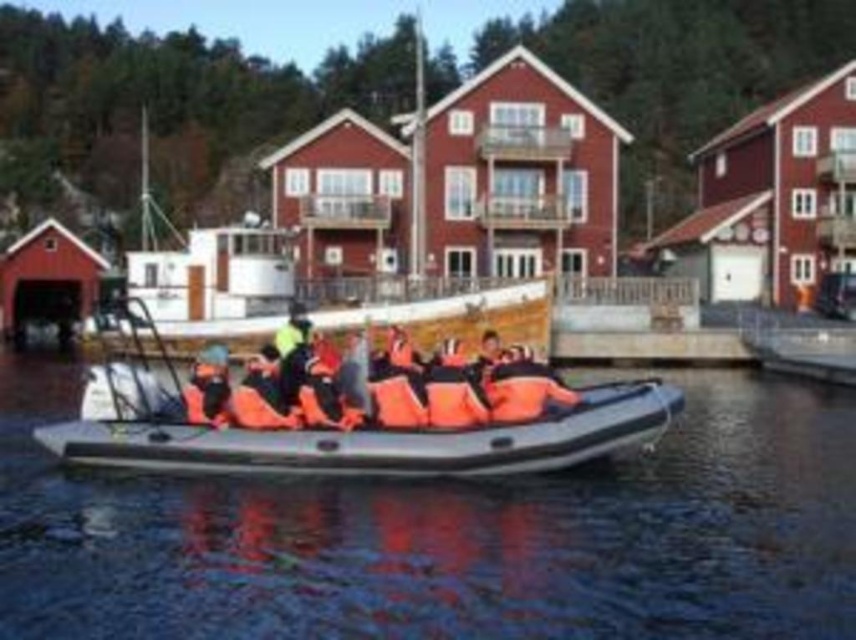
Does black rubber boat at center lie behind orange life vest at center?

That is False.

Who is shorter, black rubber boat at center or orange life vest at center?

orange life vest at center

Is point (390, 497) closer to camera compared to point (265, 362)?

Yes.

Where is `black rubber boat at center`? black rubber boat at center is located at coordinates (449, 534).

Is black rubber boat at center bigger than rubber boat at center?

Yes.

Who is taller, black rubber boat at center or rubber boat at center?

Standing taller between the two is rubber boat at center.

Does point (141, 580) come farther from viewer compared to point (379, 355)?

That is False.

Locate an element on the screen. The width and height of the screenshot is (856, 640). black rubber boat at center is located at coordinates click(x=449, y=534).

In the scene shown: Does rubber boat at center appear under orange life vest at center?

Correct, rubber boat at center is located below orange life vest at center.

Measure the distance between rubber boat at center and orange life vest at center.

4.50 feet

Which is behind, point (141, 454) or point (283, 326)?

Positioned behind is point (283, 326).

The width and height of the screenshot is (856, 640). What are the coordinates of `rubber boat at center` in the screenshot? It's located at (354, 413).